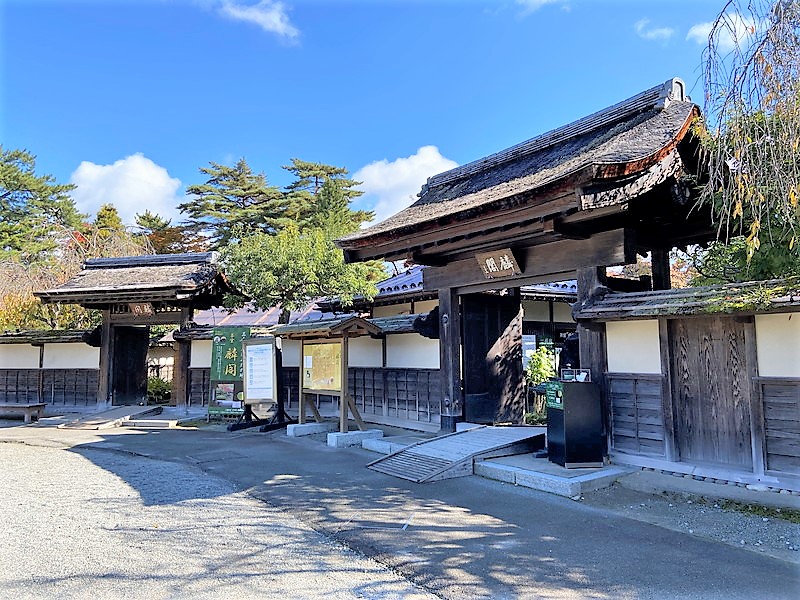
The image size is (800, 600). In order to click on shadow from walls in this screenshot , I will do `click(190, 455)`, `click(641, 557)`, `click(476, 495)`.